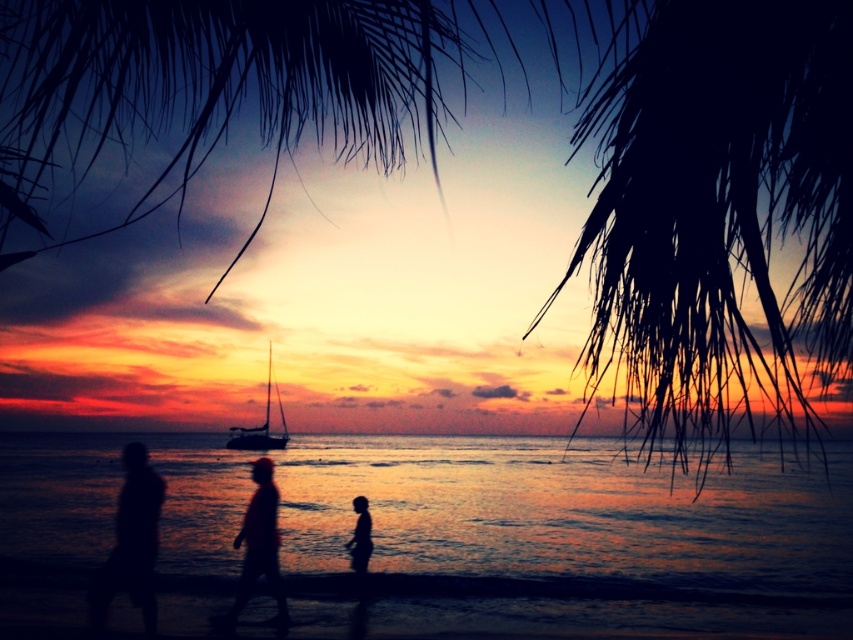
Does silky black palm fronds at upper right appear on the left side of silhouette figure at lower left?

In fact, silky black palm fronds at upper right is to the right of silhouette figure at lower left.

Is silky black palm fronds at upper right wider than silhouette figure at lower left?

Yes.

Who is more distant from viewer, [590,100] or [144,554]?

The point [144,554] is more distant.

You are a GUI agent. You are given a task and a screenshot of the screen. Output one action in this format:
    pyautogui.click(x=<x>, y=<y>)
    Task: Click on the silky black palm fronds at upper right
    
    Given the screenshot: What is the action you would take?
    pyautogui.click(x=718, y=209)

Is point (682, 385) positioned after point (247, 516)?

No.

Can you confirm if silky black palm fronds at upper right is wider than silhouette figure at center?

Indeed, silky black palm fronds at upper right has a greater width compared to silhouette figure at center.

Describe the element at coordinates (718, 209) in the screenshot. I see `silky black palm fronds at upper right` at that location.

The height and width of the screenshot is (640, 853). Identify the location of silky black palm fronds at upper right. (718, 209).

Which is below, silhouette figure at lower left or silhouette figure at lower center?

Positioned lower is silhouette figure at lower center.

Is silhouette figure at lower left to the right of silhouette figure at lower center from the viewer's perspective?

No, silhouette figure at lower left is not to the right of silhouette figure at lower center.

Between point (131, 500) and point (352, 536), which one is positioned in front?

Point (131, 500)

The height and width of the screenshot is (640, 853). Find the location of `silhouette figure at lower left`. silhouette figure at lower left is located at coordinates (131, 541).